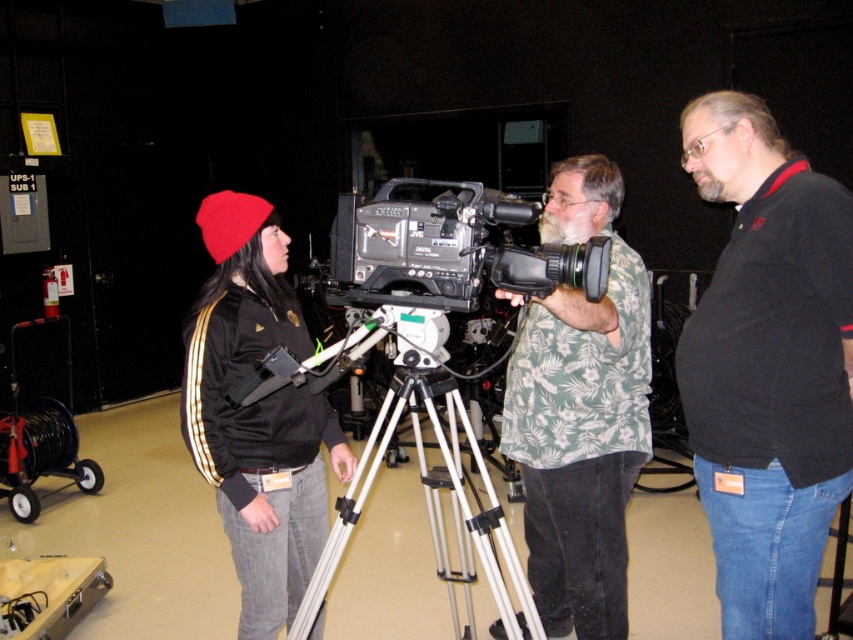
Question: Is green floral shirt at center above silver metallic camera at center?

Choices:
 (A) no
 (B) yes

Answer: (A)

Question: Which of the following is the closest to the observer?

Choices:
 (A) silver metallic camera at center
 (B) green floral shirt at center
 (C) shiny black jacket at center

Answer: (B)

Question: Which object appears farthest from the camera in this image?

Choices:
 (A) silver metallic camera at center
 (B) shiny black jacket at center

Answer: (B)

Question: Can you confirm if black cotton shirt at right is thinner than silver metallic tripod at center?

Choices:
 (A) no
 (B) yes

Answer: (B)

Question: Is black cotton shirt at right positioned in front of silver metallic tripod at center?

Choices:
 (A) no
 (B) yes

Answer: (B)

Question: Estimate the real-world distances between objects in this image. Which object is farther from the silver metallic tripod at center?

Choices:
 (A) shiny black jacket at center
 (B) green floral shirt at center

Answer: (B)